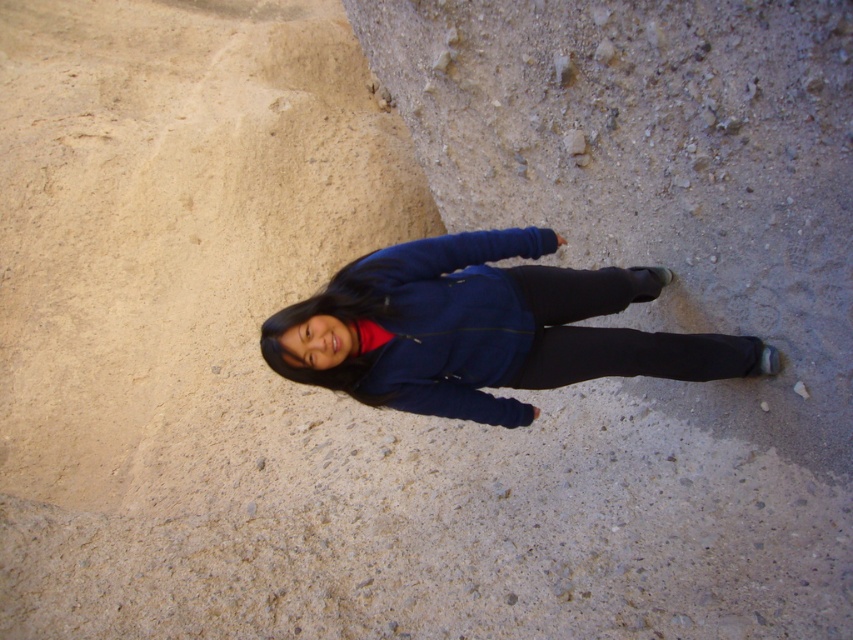
In the scene shown: You are a hiker preparing to pack your gear. You have both a blue fabric jacket at center and a matte blue sweatshirt at center. If you want to choose the one that takes up more space in your backpack, which should you pick?

The blue fabric jacket at center is bigger than the matte blue sweatshirt at center, so you should pick the blue fabric jacket at center as it takes up more space in your backpack.

You are a photographer trying to capture the person in the image. You need to know which clothing item is visible on top to adjust your focus. Which is higher up on the person, the blue fabric jacket at center or the matte blue sweatshirt at center?

The blue fabric jacket at center is above the matte blue sweatshirt at center, so it is higher up and would be the visible top layer to focus on.